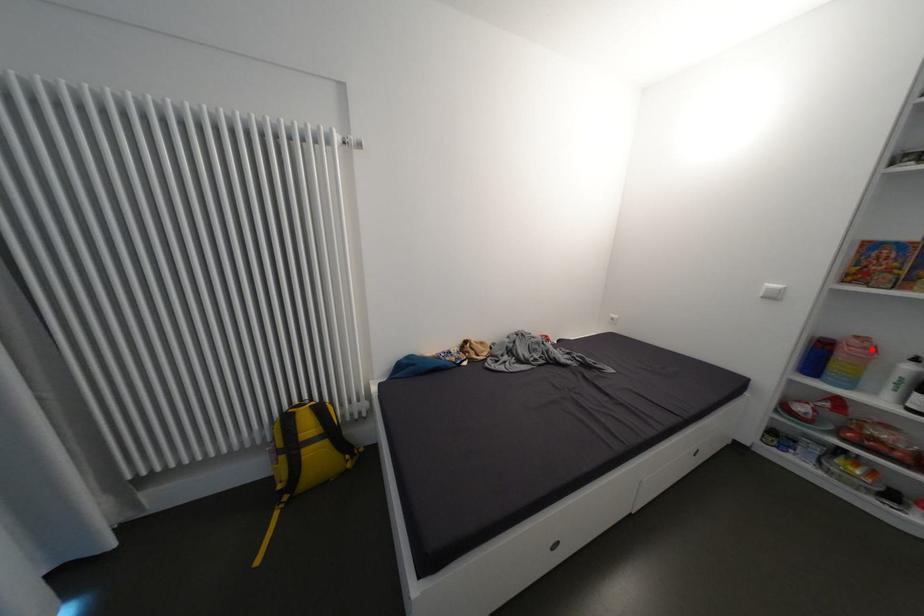
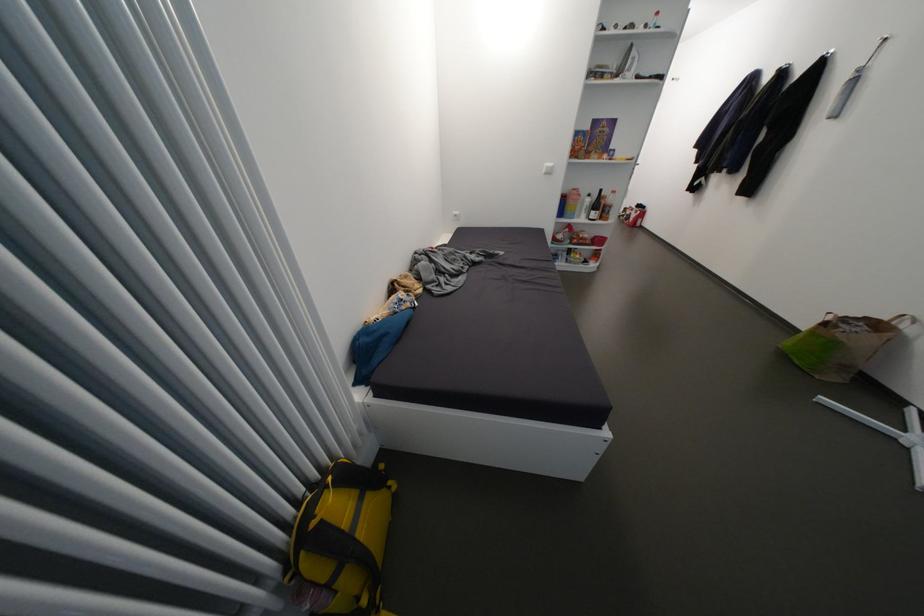
In the second image, find the point that corresponds to the highlighted location in the first image.

(585, 196)